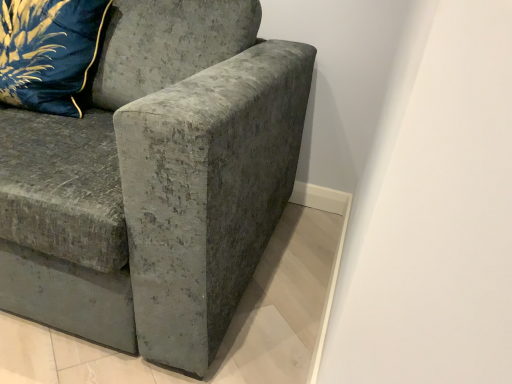
Image resolution: width=512 pixels, height=384 pixels. Identify the location of velvet gray couch at center. (155, 181).

What do you see at coordinates (155, 181) in the screenshot?
I see `velvet gray couch at center` at bounding box center [155, 181].

What do you see at coordinates (48, 52) in the screenshot? This screenshot has width=512, height=384. I see `velvet blue pillow at upper left` at bounding box center [48, 52].

You are a GUI agent. You are given a task and a screenshot of the screen. Output one action in this format:
    pyautogui.click(x=<x>, y=<y>)
    Task: Click on the velvet blue pillow at upper left
    The width and height of the screenshot is (512, 384).
    Given the screenshot: What is the action you would take?
    pyautogui.click(x=48, y=52)

Locate an element on the screen. velvet gray couch at center is located at coordinates (155, 181).

Would you say velvet blue pillow at upper left is to the left or to the right of velvet gray couch at center in the picture?

Based on their positions, velvet blue pillow at upper left is located to the left of velvet gray couch at center.

Is velvet blue pillow at upper left behind velvet gray couch at center?

Yes, velvet blue pillow at upper left is further from the viewer.

Considering the points (6, 6) and (240, 205), which point is in front, point (6, 6) or point (240, 205)?

The point (240, 205) is in front.

From the image's perspective, which one is positioned higher, velvet blue pillow at upper left or velvet gray couch at center?

velvet blue pillow at upper left, from the image's perspective.

From a real-world perspective, who is located higher, velvet blue pillow at upper left or velvet gray couch at center?

velvet blue pillow at upper left.

Considering the relative sizes of velvet blue pillow at upper left and velvet gray couch at center in the image provided, is velvet blue pillow at upper left wider than velvet gray couch at center?

In fact, velvet blue pillow at upper left might be narrower than velvet gray couch at center.

Can you confirm if velvet blue pillow at upper left is shorter than velvet gray couch at center?

Indeed, velvet blue pillow at upper left has a lesser height compared to velvet gray couch at center.

From the picture: Who is smaller, velvet blue pillow at upper left or velvet gray couch at center?

velvet blue pillow at upper left is smaller.

Is velvet gray couch at center surrounded by velvet blue pillow at upper left?

No, velvet gray couch at center is not inside velvet blue pillow at upper left.

Is velvet blue pillow at upper left positioned far away from velvet gray couch at center?

No, velvet blue pillow at upper left is in close proximity to velvet gray couch at center.

Could you tell me if velvet blue pillow at upper left is turned towards velvet gray couch at center?

Yes, velvet blue pillow at upper left is oriented towards velvet gray couch at center.

Identify the location of studio couch lying below the velvet blue pillow at upper left (from the image's perspective). (155, 181).

Does velvet gray couch at center appear on the right side of velvet blue pillow at upper left?

Indeed, velvet gray couch at center is positioned on the right side of velvet blue pillow at upper left.

Is the position of velvet gray couch at center less distant than that of velvet blue pillow at upper left?

Yes, it is in front of velvet blue pillow at upper left.

Which is in front, point (44, 292) or point (21, 79)?

Positioned in front is point (44, 292).

From the image's perspective, is velvet gray couch at center located above or below velvet blue pillow at upper left?

velvet gray couch at center is below velvet blue pillow at upper left.

From a real-world perspective, is velvet gray couch at center beneath velvet blue pillow at upper left?

Indeed, from a real-world perspective, velvet gray couch at center is positioned beneath velvet blue pillow at upper left.

In terms of width, does velvet gray couch at center look wider or thinner when compared to velvet blue pillow at upper left?

In the image, velvet gray couch at center appears to be wider than velvet blue pillow at upper left.

Considering the relative sizes of velvet gray couch at center and velvet blue pillow at upper left in the image provided, is velvet gray couch at center shorter than velvet blue pillow at upper left?

Incorrect, the height of velvet gray couch at center does not fall short of that of velvet blue pillow at upper left.

Can you confirm if velvet gray couch at center is bigger than velvet blue pillow at upper left?

Correct, velvet gray couch at center is larger in size than velvet blue pillow at upper left.

Is velvet gray couch at center situated inside velvet blue pillow at upper left or outside?

velvet gray couch at center lies outside velvet blue pillow at upper left.

Is the surface of velvet gray couch at center in direct contact with velvet blue pillow at upper left?

velvet gray couch at center and velvet blue pillow at upper left are not in contact.

Does velvet gray couch at center turn towards velvet blue pillow at upper left?

Yes, velvet gray couch at center is aimed at velvet blue pillow at upper left.

From the picture: How different are the orientations of velvet gray couch at center and velvet blue pillow at upper left in degrees?

There is a 6.34-degree angle between the facing directions of velvet gray couch at center and velvet blue pillow at upper left.

How distant is velvet gray couch at center from velvet blue pillow at upper left?

velvet gray couch at center is 14.50 inches away from velvet blue pillow at upper left.

Locate an element on the screen. The image size is (512, 384). pillow behind the velvet gray couch at center is located at coordinates pyautogui.click(x=48, y=52).

The width and height of the screenshot is (512, 384). In order to click on studio couch lying below the velvet blue pillow at upper left (from the image's perspective) in this screenshot , I will do `click(155, 181)`.

In order to click on studio couch directly beneath the velvet blue pillow at upper left (from a real-world perspective) in this screenshot , I will do `click(155, 181)`.